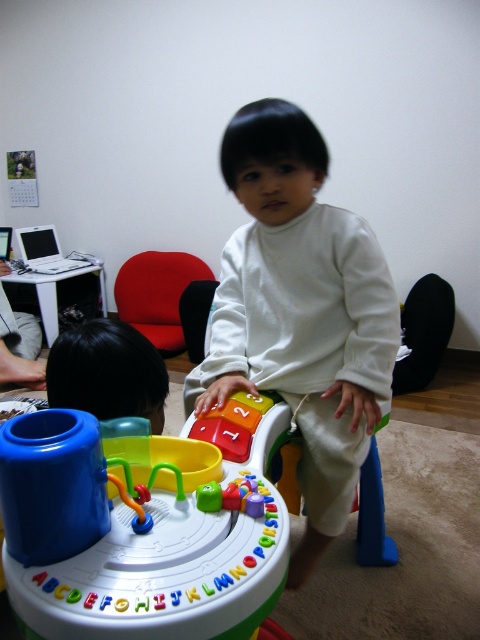
You are a photographer setting up for a photoshoot. You need to position a light source to the left of the white matte toddler at center and to the right of the red fabric chair at center. Is this possible based on their current positions?

The white matte toddler at center is to the right of the red fabric chair at center, so placing the light source to the left of the white matte toddler at center and to the right of the red fabric chair at center is possible since the toddler is already positioned to the right of the chair.

Consider the image. You are a photographer standing in front of the scene described. You want to take a photo of the white matte toddler at center without including the red chair in the background. Based on their position, is this possible?

The white matte toddler at center is 1.08 meters away from the viewer. Since the red chair is positioned behind the toddler, the photographer can position themselves so that the toddler blocks the view of the chair, making it possible to take a photo without including the chair in the background.